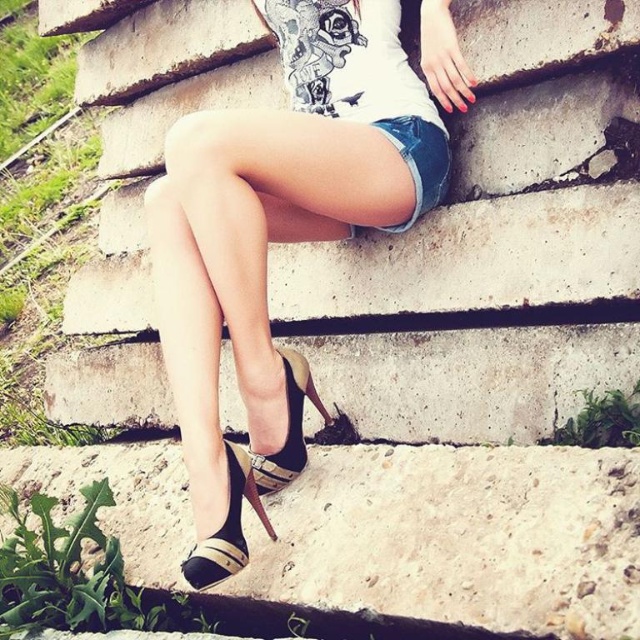
Question: Can you confirm if leather high heels at center is positioned below black leather sandal at lower center?

Choices:
 (A) yes
 (B) no

Answer: (B)

Question: Which object appears farthest from the camera in this image?

Choices:
 (A) black leather sandal at lower center
 (B) shiny gold sandal at center

Answer: (B)

Question: Which point appears farthest from the camera in this image?

Choices:
 (A) (227, 243)
 (B) (384, 124)
 (C) (378, 70)
 (D) (244, 486)

Answer: (C)

Question: Is leather high heels at center further to camera compared to black leather sandal at lower center?

Choices:
 (A) no
 (B) yes

Answer: (B)

Question: Which of these objects is positioned closest to the white printed t-shirt at center?

Choices:
 (A) denim shorts at center
 (B) shiny gold sandal at center
 (C) leather high heels at center

Answer: (C)

Question: Is white printed t-shirt at center above shiny gold sandal at center?

Choices:
 (A) yes
 (B) no

Answer: (A)